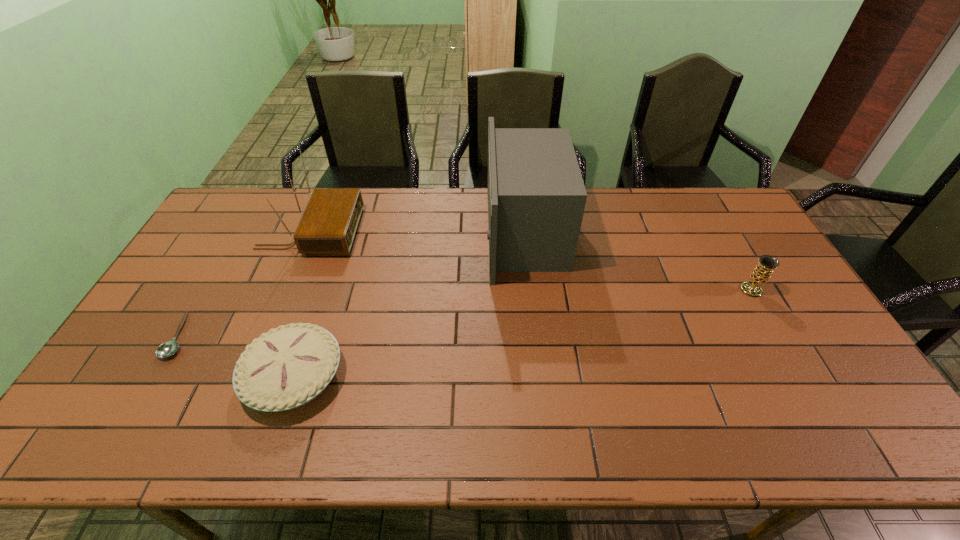
Identify the location of free space that satisfies the following two spatial constraints: 1. on the front-facing side of the microwave oven; 2. on the left side of the chalice. The image size is (960, 540). (531, 290).

In order to click on vacant region that satisfies the following two spatial constraints: 1. on the front panel of the fourth shortest object; 2. on the left side of the pie in this screenshot , I will do `click(251, 376)`.